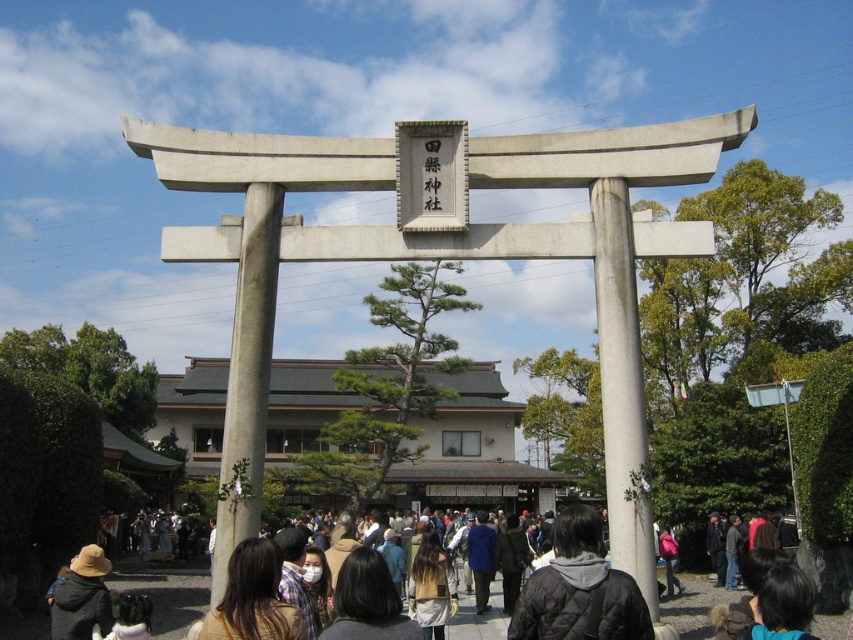
Question: Which point appears closest to the camera in this image?

Choices:
 (A) (672, 545)
 (B) (492, 554)
 (C) (352, 577)

Answer: (C)

Question: Does black quilted jacket at center appear on the right side of light brown hair at center?

Choices:
 (A) yes
 (B) no

Answer: (A)

Question: From the image, what is the correct spatial relationship of black hair at lower center in relation to blue fabric jacket at center?

Choices:
 (A) above
 (B) below

Answer: (A)

Question: Does black quilted jacket at center have a larger size compared to dark brown hair at center?

Choices:
 (A) yes
 (B) no

Answer: (B)

Question: Which of the following is the closest to the observer?

Choices:
 (A) (579, 538)
 (B) (259, 616)

Answer: (B)

Question: Among these points, which one is nearest to the camera?

Choices:
 (A) (439, 588)
 (B) (337, 598)
 (C) (755, 605)
 (D) (663, 540)

Answer: (B)